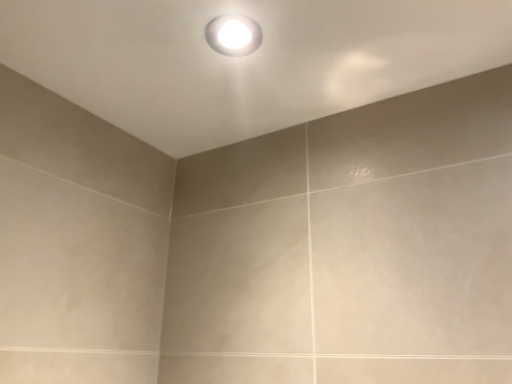
Where is `white glossy droplight at upper center`? white glossy droplight at upper center is located at coordinates (233, 35).

This screenshot has height=384, width=512. What do you see at coordinates (233, 35) in the screenshot?
I see `white glossy droplight at upper center` at bounding box center [233, 35].

In the scene shown: What is the approximate height of white glossy droplight at upper center?

white glossy droplight at upper center is 0.50 inches tall.

Where is `white glossy droplight at upper center`? Image resolution: width=512 pixels, height=384 pixels. white glossy droplight at upper center is located at coordinates (233, 35).